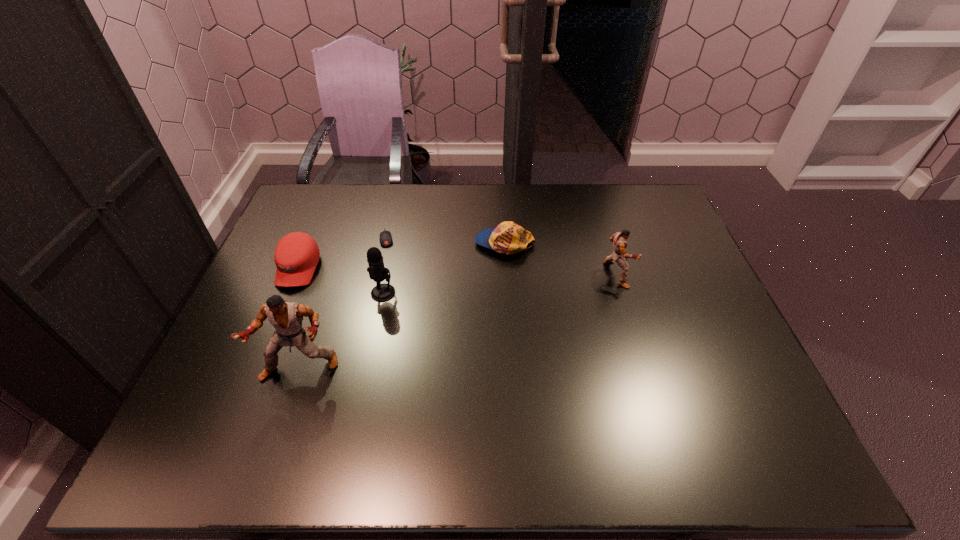
Please determine a free point for an extra puncher to ensure balance. Please provide its 2D coordinates. Your answer should be formatted as a tuple, i.e. [(x, y)], where the tuple contains the x and y coordinates of a point satisfying the conditions above.

[(473, 316)]